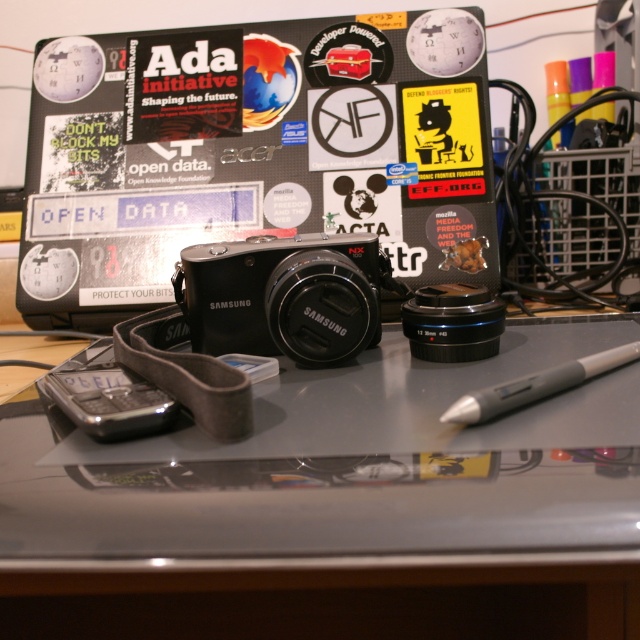
Question: Among these objects, which one is farthest from the camera?

Choices:
 (A) metallic gray mousepad at center
 (B) gray matte pen at lower right

Answer: (B)

Question: Among these points, which one is farthest from the camera?

Choices:
 (A) (337, 632)
 (B) (465, 406)

Answer: (A)

Question: Can you confirm if metallic gray mousepad at center is positioned to the left of gray matte pen at lower right?

Choices:
 (A) no
 (B) yes

Answer: (B)

Question: Which point is closer to the camera?

Choices:
 (A) gray matte pen at lower right
 (B) metallic gray mousepad at center

Answer: (B)

Question: Does metallic gray mousepad at center have a smaller size compared to gray matte pen at lower right?

Choices:
 (A) yes
 (B) no

Answer: (B)

Question: Does metallic gray mousepad at center have a greater width compared to gray matte pen at lower right?

Choices:
 (A) no
 (B) yes

Answer: (B)